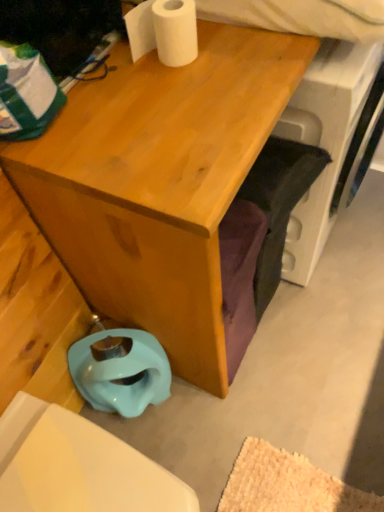
In order to click on matte wood desk at center in this screenshot , I will do `click(159, 182)`.

Which object is more forward, light blue rubber toilet bowl at lower left or white matte toilet paper at upper center?

white matte toilet paper at upper center.

Considering the relative sizes of light blue rubber toilet bowl at lower left and white matte toilet paper at upper center in the image provided, is light blue rubber toilet bowl at lower left bigger than white matte toilet paper at upper center?

Yes, light blue rubber toilet bowl at lower left is bigger than white matte toilet paper at upper center.

Is light blue rubber toilet bowl at lower left positioned far away from white matte toilet paper at upper center?

No, light blue rubber toilet bowl at lower left is in close proximity to white matte toilet paper at upper center.

Is light blue rubber toilet bowl at lower left oriented away from white matte toilet paper at upper center?

No, light blue rubber toilet bowl at lower left's orientation is not away from white matte toilet paper at upper center.

Could you tell me if light blue rubber toilet bowl at lower left is facing matte wood desk at center?

No, light blue rubber toilet bowl at lower left is not oriented towards matte wood desk at center.

Does point (106, 331) appear closer or farther from the camera than point (139, 227)?

Point (106, 331) appears to be farther away from the viewer than point (139, 227).

From a real-world perspective, is light blue rubber toilet bowl at lower left positioned above or below matte wood desk at center?

From a real-world perspective, light blue rubber toilet bowl at lower left is physically below matte wood desk at center.

This screenshot has width=384, height=512. Identify the location of toilet bowl located on the left of matte wood desk at center. (120, 370).

Which object is thinner, white matte toilet paper at upper center or matte wood desk at center?

With smaller width is white matte toilet paper at upper center.

The width and height of the screenshot is (384, 512). I want to click on desk on the right side of white matte toilet paper at upper center, so click(159, 182).

Are white matte toilet paper at upper center and matte wood desk at center located far from each other?

white matte toilet paper at upper center is actually quite close to matte wood desk at center.

Who is bigger, white matte toilet paper at upper center or matte wood desk at center?

matte wood desk at center.

Is matte wood desk at center smaller than white matte toilet paper at upper center?

Actually, matte wood desk at center might be larger than white matte toilet paper at upper center.

Would you say matte wood desk at center is outside white matte toilet paper at upper center?

Yes, matte wood desk at center is located beyond the bounds of white matte toilet paper at upper center.

Considering the sizes of objects white matte toilet paper at upper center and light blue rubber toilet bowl at lower left in the image provided, who is bigger, white matte toilet paper at upper center or light blue rubber toilet bowl at lower left?

light blue rubber toilet bowl at lower left.

At what (x,y) coordinates should I click in order to perform the action: click on toilet bowl behind the white matte toilet paper at upper center. Please return your answer as a coordinate pair (x, y). This screenshot has height=512, width=384. Looking at the image, I should click on (120, 370).

Considering the positions of objects white matte toilet paper at upper center and light blue rubber toilet bowl at lower left in the image provided, who is in front, white matte toilet paper at upper center or light blue rubber toilet bowl at lower left?

white matte toilet paper at upper center is in front.

In the image, is white matte toilet paper at upper center on the left side or the right side of light blue rubber toilet bowl at lower left?

white matte toilet paper at upper center is positioned on light blue rubber toilet bowl at lower left's right side.

Is matte wood desk at center facing towards light blue rubber toilet bowl at lower left?

No, matte wood desk at center is not aimed at light blue rubber toilet bowl at lower left.

Based on the photo, is matte wood desk at center further to the viewer compared to light blue rubber toilet bowl at lower left?

That is False.

Image resolution: width=384 pixels, height=512 pixels. I want to click on toilet bowl on the left side of matte wood desk at center, so (x=120, y=370).

At what (x,y) coordinates should I click in order to perform the action: click on toilet bowl below the white matte toilet paper at upper center (from a real-world perspective). Please return your answer as a coordinate pair (x, y). The width and height of the screenshot is (384, 512). Looking at the image, I should click on (120, 370).

You are a GUI agent. You are given a task and a screenshot of the screen. Output one action in this format:
    pyautogui.click(x=<x>, y=<y>)
    Task: Click on the toilet bowl to the left of matte wood desk at center
    
    Given the screenshot: What is the action you would take?
    pyautogui.click(x=120, y=370)

Which object lies nearer to the anchor point light blue rubber toilet bowl at lower left, matte wood desk at center or white matte toilet paper at upper center?

The object closer to light blue rubber toilet bowl at lower left is matte wood desk at center.

Based on the photo, looking at the image, which one is located further to matte wood desk at center, white matte toilet paper at upper center or light blue rubber toilet bowl at lower left?

Based on the image, light blue rubber toilet bowl at lower left appears to be further to matte wood desk at center.

When comparing their distances from white matte toilet paper at upper center, does matte wood desk at center or light blue rubber toilet bowl at lower left seem closer?

matte wood desk at center.

Looking at the image, which one is located closer to light blue rubber toilet bowl at lower left, white matte toilet paper at upper center or matte wood desk at center?

matte wood desk at center is positioned closer to the anchor light blue rubber toilet bowl at lower left.

Based on their spatial positions, is light blue rubber toilet bowl at lower left or matte wood desk at center further from white matte toilet paper at upper center?

light blue rubber toilet bowl at lower left.

From the image, which object appears to be farther from matte wood desk at center, light blue rubber toilet bowl at lower left or white matte toilet paper at upper center?

The object further to matte wood desk at center is light blue rubber toilet bowl at lower left.

Where is `desk between white matte toilet paper at upper center and light blue rubber toilet bowl at lower left in the vertical direction`? This screenshot has height=512, width=384. desk between white matte toilet paper at upper center and light blue rubber toilet bowl at lower left in the vertical direction is located at coordinates (159, 182).